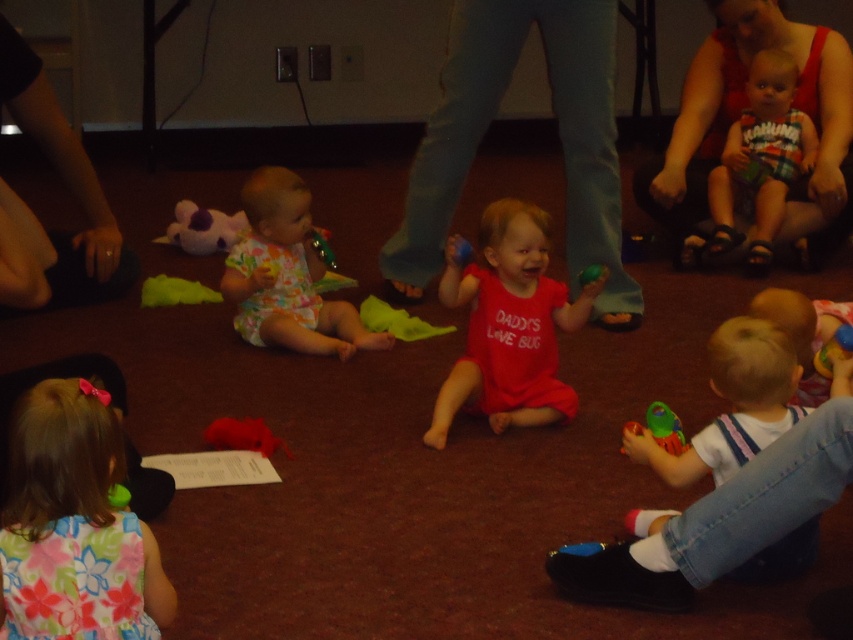
Does white soft toy at lower right come behind green rubber duck at center?

No, white soft toy at lower right is closer to the viewer.

What are the coordinates of `white soft toy at lower right` in the screenshot? It's located at (733, 404).

Based on the photo, who is more distant from viewer, (322, 301) or (207, 221)?

Positioned behind is point (207, 221).

Is floral fabric baby at center below purple plush toy at upper left?

Correct, floral fabric baby at center is located below purple plush toy at upper left.

Between point (335, 348) and point (192, 250), which one is positioned behind?

Positioned behind is point (192, 250).

This screenshot has height=640, width=853. What are the coordinates of `floral fabric baby at center` in the screenshot? It's located at (287, 275).

Is purple plush toy at upper left closer to the viewer compared to translucent plastic cup at lower right?

No, purple plush toy at upper left is further to the viewer.

Is purple plush toy at upper left bigger than translucent plastic cup at lower right?

Yes.

Is point (209, 241) farther from camera compared to point (660, 420)?

That is True.

This screenshot has height=640, width=853. Find the location of `purple plush toy at upper left`. purple plush toy at upper left is located at coordinates (202, 228).